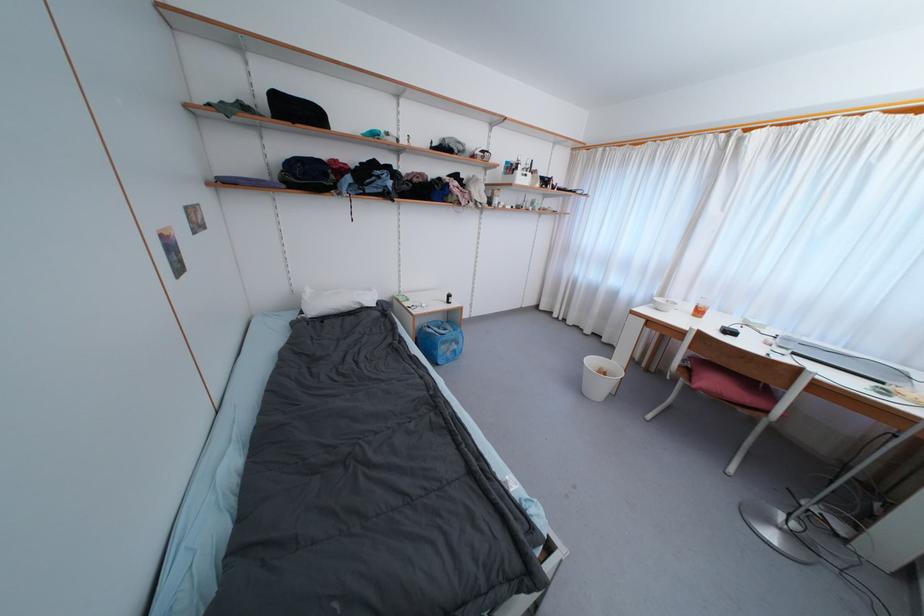
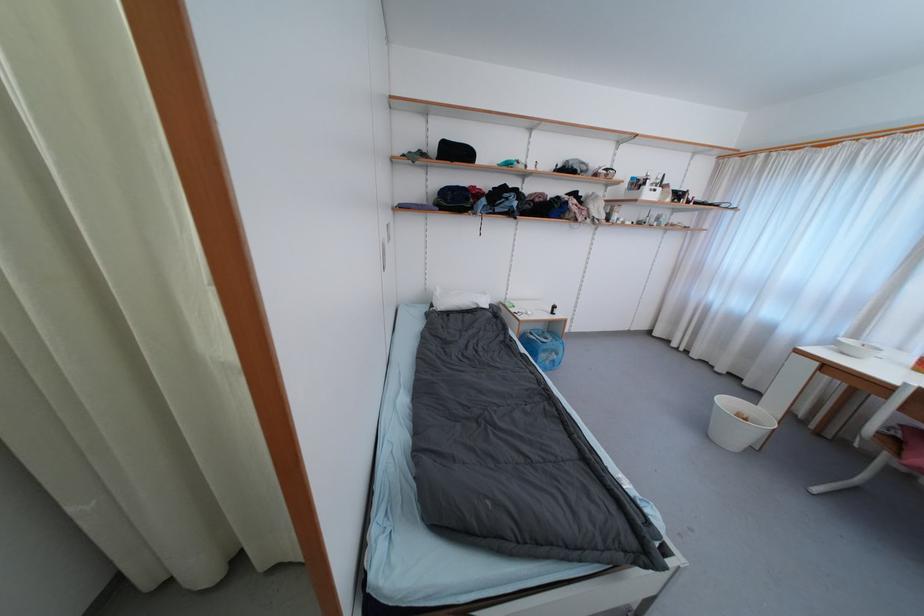
In the second image, find the point that corresponds to [339,163] in the first image.

(478, 190)